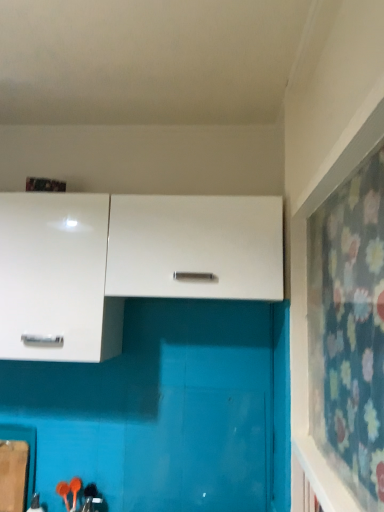
Question: From a real-world perspective, is white glossy cabinet at upper left, marked as the second cabinetry in a right-to-left arrangement, physically located above or below floral fabric curtain at right?

Choices:
 (A) above
 (B) below

Answer: (A)

Question: Relative to floral fabric curtain at right, is white glossy cabinet at upper left, marked as the second cabinetry in a right-to-left arrangement, in front or behind?

Choices:
 (A) front
 (B) behind

Answer: (B)

Question: Which object is the farthest from the white matte cabinet at center, placed as the 1th cabinetry when sorted from right to left?

Choices:
 (A) white glossy cabinet at upper left, which is the 1th cabinetry in left-to-right order
 (B) floral fabric curtain at right

Answer: (B)

Question: Which object is positioned farthest from the white glossy cabinet at upper left, which is the 1th cabinetry in left-to-right order?

Choices:
 (A) white matte cabinet at center, acting as the 2th cabinetry starting from the left
 (B) floral fabric curtain at right

Answer: (B)